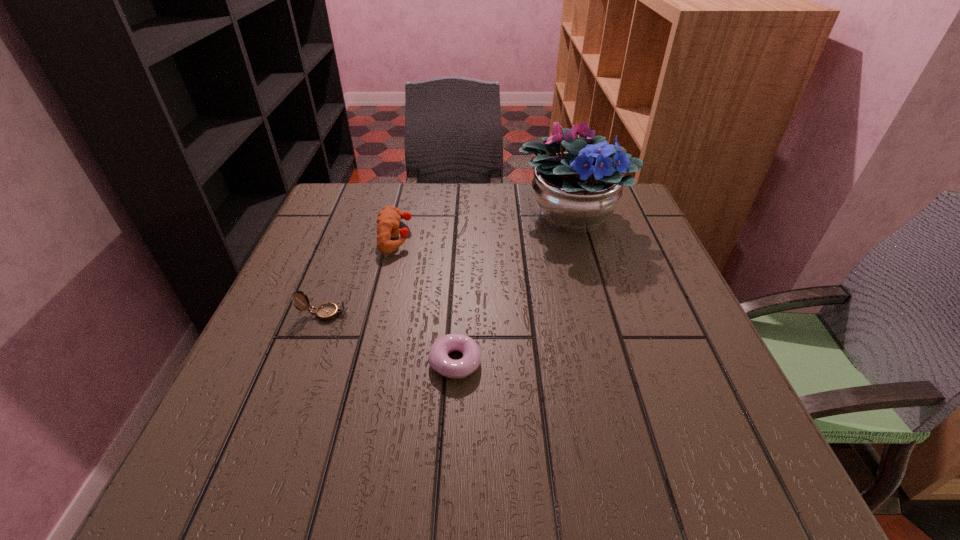
Where is `blank space at the right edge of the desktop`? blank space at the right edge of the desktop is located at coordinates (638, 318).

The height and width of the screenshot is (540, 960). I want to click on vacant area at the far left corner of the desktop, so [343, 221].

Identify the location of vacant space at the far right corner of the desktop. The image size is (960, 540). (645, 224).

This screenshot has width=960, height=540. What are the coordinates of `free space between the tallest object and the puncher` in the screenshot? It's located at (484, 225).

You are a GUI agent. You are given a task and a screenshot of the screen. Output one action in this format:
    pyautogui.click(x=<x>, y=<y>)
    Task: Click on the empty space that is in between the nearest object and the third tallest object
    The height and width of the screenshot is (540, 960).
    Given the screenshot: What is the action you would take?
    pyautogui.click(x=390, y=338)

What are the coordinates of `free space between the second tallest object and the second object from right to left` in the screenshot? It's located at (425, 299).

Identify the location of free space between the rightmost object and the leftmost object. (447, 264).

Identify the location of free space between the compass and the tallest object. (447, 264).

The height and width of the screenshot is (540, 960). In order to click on free area in between the nearest object and the tallest object in this screenshot , I will do `click(513, 287)`.

Identify the location of free space between the leftmost object and the second tallest object. This screenshot has width=960, height=540. (360, 275).